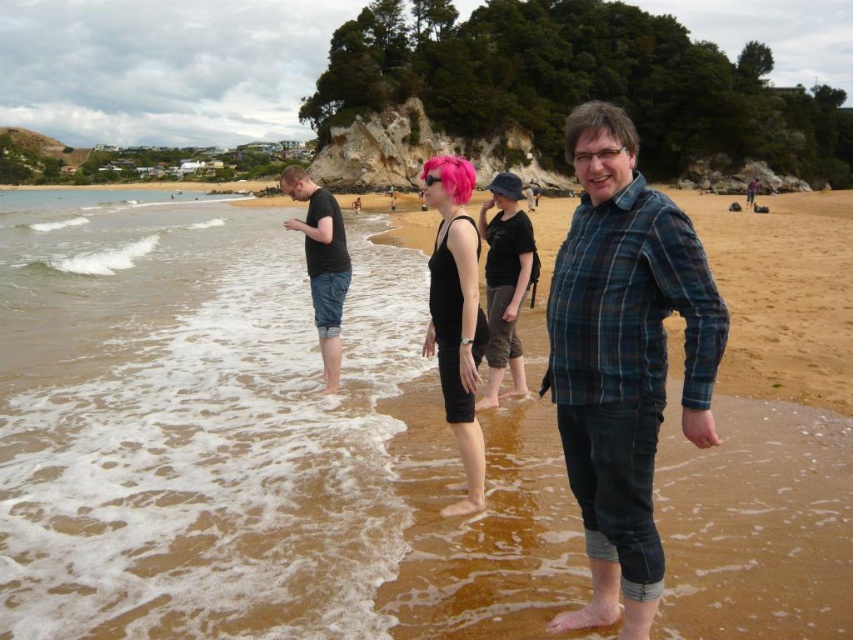
Question: Which of the following is the closest to the observer?

Choices:
 (A) (209, 616)
 (B) (473, 170)
 (C) (517, 349)
 (D) (618, 401)

Answer: (A)

Question: Is brown sandy water at lower left further to the viewer compared to black cotton tank top at center?

Choices:
 (A) no
 (B) yes

Answer: (A)

Question: Which point appears farthest from the camera in this image?

Choices:
 (A) (625, 492)
 (B) (436, 276)
 (C) (529, 227)
 (D) (329, 234)

Answer: (D)

Question: Can you confirm if plaid flannel shirt at center is bigger than pink matte hair at center?

Choices:
 (A) yes
 (B) no

Answer: (A)

Question: Can you confirm if pink matte hair at center is wider than black cotton shirt at left?

Choices:
 (A) yes
 (B) no

Answer: (B)

Question: Which object appears closest to the camera in this image?

Choices:
 (A) brown sandy water at lower left
 (B) brown sand at center
 (C) black cotton shirt at left
 (D) plaid flannel shirt at center

Answer: (D)